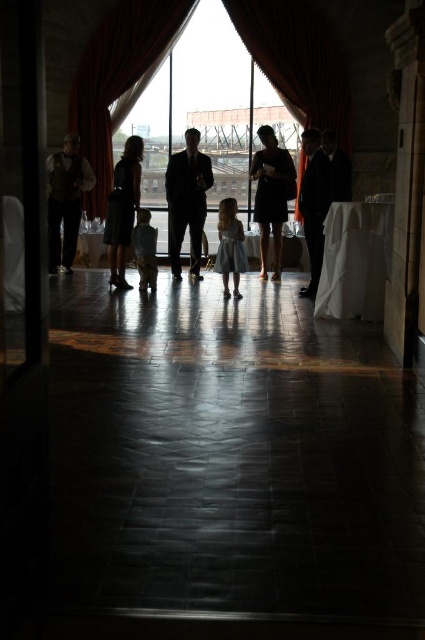
You are a photographer positioned at the camera. You want to capture a closeup of the silky black suit at center. Given that your camera can focus on objects within 5 meters, can you adjust your position to get a clear shot?

The silky black suit at center is 7.85 meters away from the camera. Since the camera can only focus within 5 meters, you need to move closer to reduce the distance to within 5 meters to get a clear shot.

You are a photographer at the event and need to position a spotlight between the silhouette dress at center and the matte black suit at right. Since the spotlight requires 1 meter of space, will there be enough room between them?

The silhouette dress at center is wider than the matte black suit at right, but the description does not provide the exact distance between them. Therefore, it is uncertain if there is enough space for the spotlight.

You are a photographer at the event and need to position a 1.2 meter wide lighting setup between the transparent glass window at center and the velvet dark red curtain at center. Can the space between them accommodate the setup?

The transparent glass window at center is wider than the velvet dark red curtain at center. However, the exact distance between them isn generated from the provided information. Without knowing the distance between the two objects, it is impossible to determine if the 1.2 meter wide lighting setup will fit.